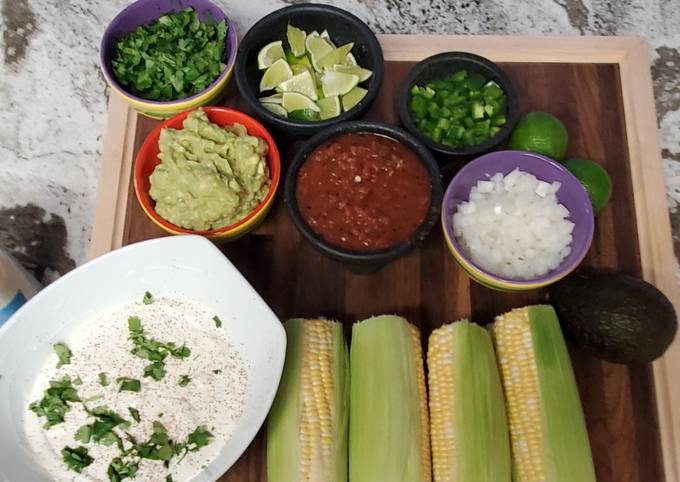
Where is `cuttingboard`? cuttingboard is located at coordinates (593, 94).